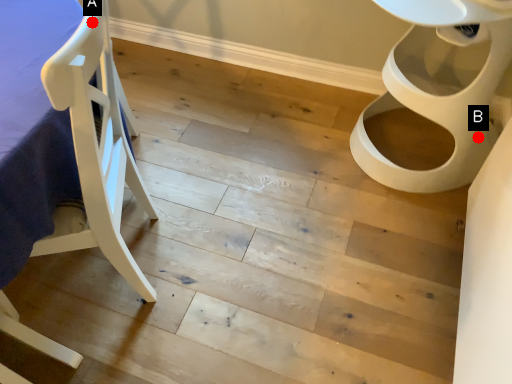
Question: Two points are circled on the image, labeled by A and B beside each circle. Among these points, which one is nearest to the camera?

Choices:
 (A) A is closer
 (B) B is closer

Answer: (A)